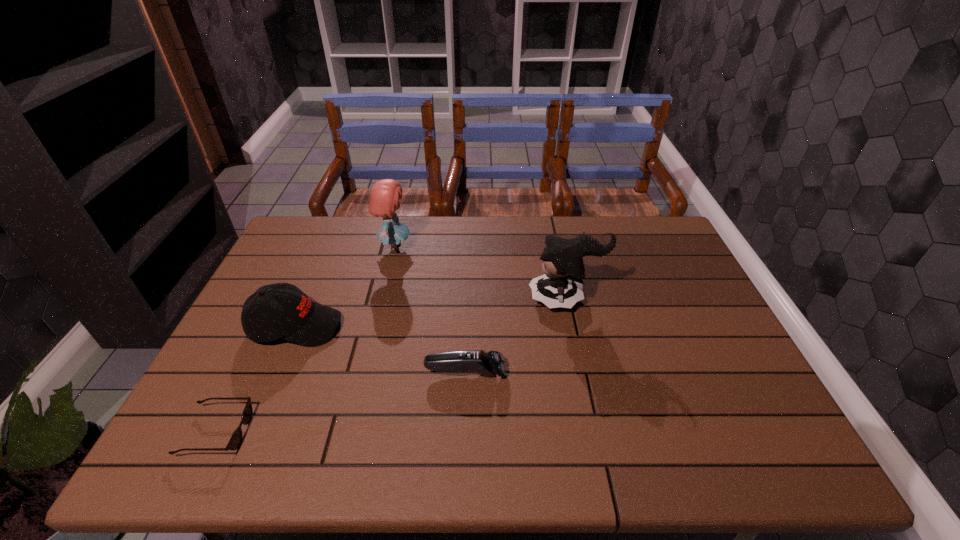
You are a GUI agent. You are given a task and a screenshot of the screen. Output one action in this format:
    pyautogui.click(x=<x>, y=<y>)
    Task: Click on the blank region between the rightmost object and the third tallest object
    The height and width of the screenshot is (540, 960).
    Given the screenshot: What is the action you would take?
    pyautogui.click(x=431, y=313)

This screenshot has width=960, height=540. I want to click on vacant point located between the shortest object and the electric shaver, so click(341, 402).

Where is `free space between the shortest object and the rightmost object`? free space between the shortest object and the rightmost object is located at coordinates (392, 366).

This screenshot has width=960, height=540. In order to click on free area in between the fourth tallest object and the nearer doll in this screenshot , I will do `click(516, 335)`.

This screenshot has height=540, width=960. I want to click on vacant area between the baseball cap and the nearest object, so click(256, 379).

The width and height of the screenshot is (960, 540). What are the coordinates of `free space between the nearer doll and the baseball cap` in the screenshot? It's located at (431, 313).

You are a GUI agent. You are given a task and a screenshot of the screen. Output one action in this format:
    pyautogui.click(x=<x>, y=<y>)
    Task: Click on the object that is the second closest to the farthest object
    Image resolution: width=960 pixels, height=540 pixels.
    Given the screenshot: What is the action you would take?
    pyautogui.click(x=561, y=286)

Locate which object ranks fourth in proximity to the third object from left to right. Please provide its 2D coordinates. Your answer should be formatted as a tuple, i.e. [(x, y)], where the tuple contains the x and y coordinates of a point satisfying the conditions above.

[(236, 438)]